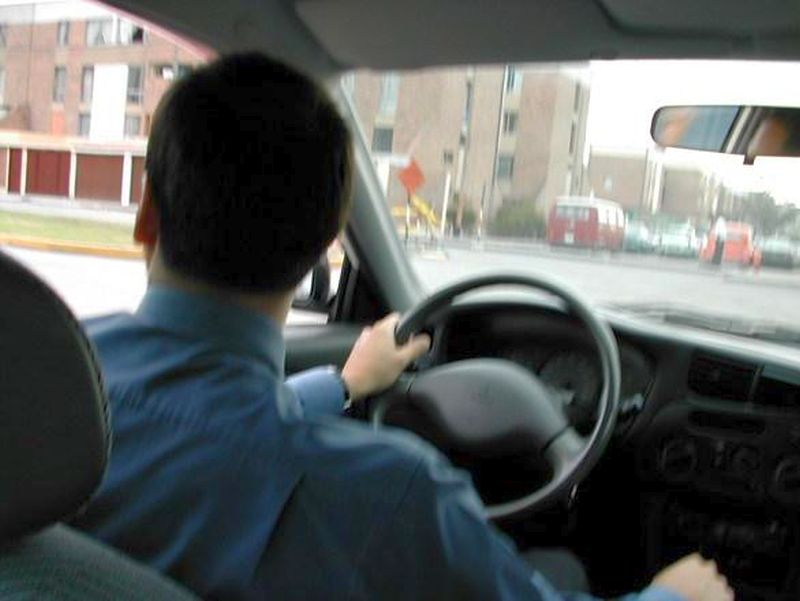
At what (x,y) coordinates should I click in order to perform the action: click on mirror. Please return your answer as a coordinate pair (x, y). Image resolution: width=800 pixels, height=601 pixels. Looking at the image, I should click on (733, 135).